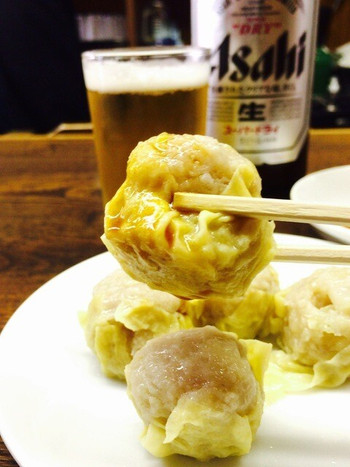
You are a GUI agent. You are given a task and a screenshot of the screen. Output one action in this format:
    pyautogui.click(x=<x>, y=<y>)
    Task: Click on the table
    
    Given the screenshot: What is the action you would take?
    pyautogui.click(x=21, y=240)